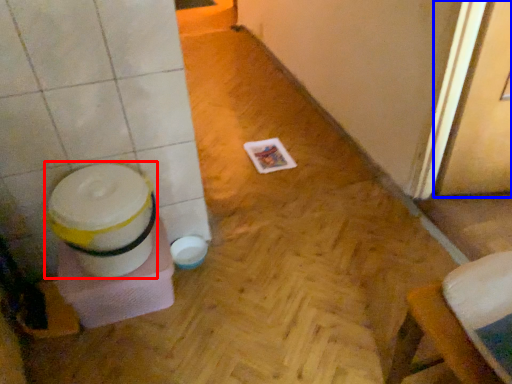
Question: Which point is further to the camera, potty (highlighted by a red box) or screen door (highlighted by a blue box)?

Choices:
 (A) potty
 (B) screen door

Answer: (A)